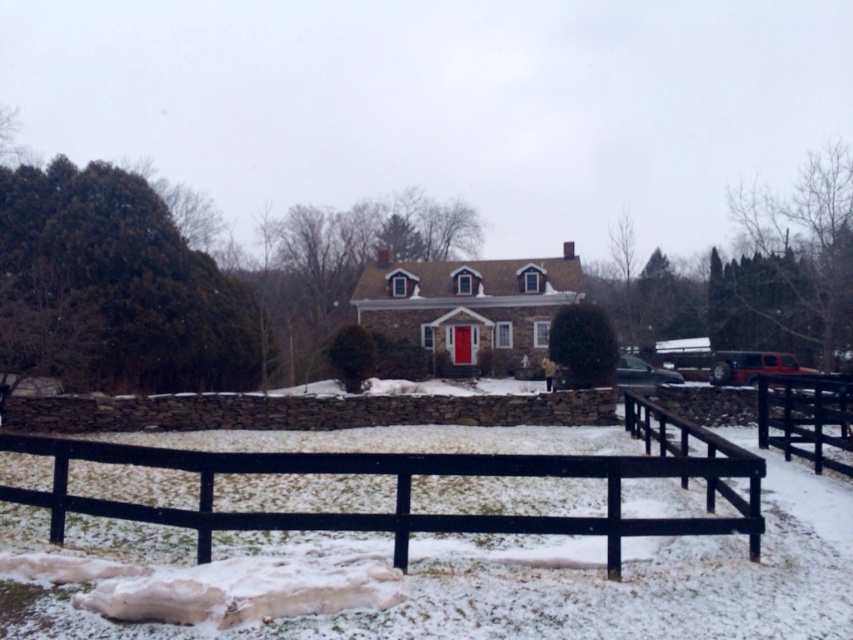
You are standing in front of the house and want to determine the relative positions of two points marked in the image. Which point is closer to you, point 1 at coordinates point (589, 472) or point 2 at coordinates point (811, 404)?

Point 1 at coordinates point (589, 472) is closer to you than point 2 at coordinates point (811, 404).

You are a delivery person trying to see the front door of the traditional house. You are standing outside the black wooden fence at center and the black wooden fence at lower right. Which fence section allows you to see the front door better?

The black wooden fence at lower right allows you to see the front door better because it is taller than the black wooden fence at center.

You are standing at the front door of the traditional house and want to walk from the black wooden fence at center to the black wooden fence at lower right. How far will you have to walk?

The distance between the black wooden fence at center and the black wooden fence at lower right is 4.23 meters, so you will have to walk 4.23 meters to reach the destination.